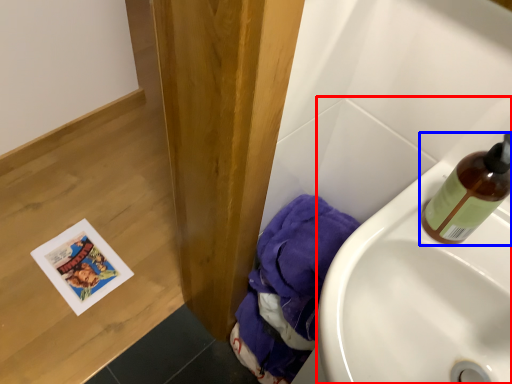
Question: Which of the following is the farthest to the observer, sink (highlighted by a red box) or bottle (highlighted by a blue box)?

Choices:
 (A) sink
 (B) bottle

Answer: (B)